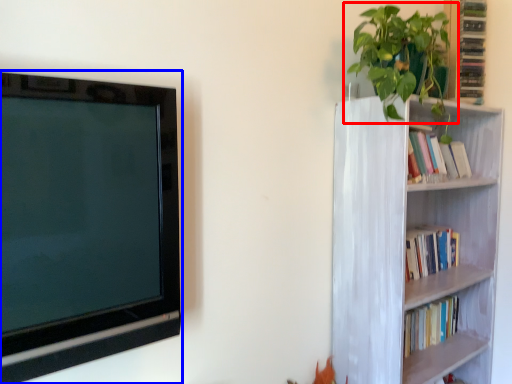
Question: Among these objects, which one is farthest to the camera, houseplant (highlighted by a red box) or television (highlighted by a blue box)?

Choices:
 (A) houseplant
 (B) television

Answer: (A)